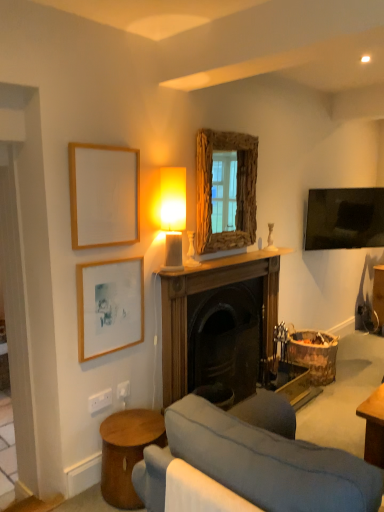
Question: From the image's perspective, is velvet grey couch at lower center located above rustic wood mirror at upper center?

Choices:
 (A) yes
 (B) no

Answer: (B)

Question: Is velvet grey couch at lower center thinner than rustic wood mirror at upper center?

Choices:
 (A) yes
 (B) no

Answer: (B)

Question: Would you say velvet grey couch at lower center contains rustic wood mirror at upper center?

Choices:
 (A) yes
 (B) no

Answer: (B)

Question: From a real-world perspective, is velvet grey couch at lower center under rustic wood mirror at upper center?

Choices:
 (A) yes
 (B) no

Answer: (A)

Question: Does velvet grey couch at lower center have a larger size compared to rustic wood mirror at upper center?

Choices:
 (A) yes
 (B) no

Answer: (A)

Question: In terms of height, does matte wooden picture frame at upper left, which is the 1th picture frame from top to bottom, look taller or shorter compared to rustic wood mirror at upper center?

Choices:
 (A) short
 (B) tall

Answer: (A)

Question: Is matte wooden picture frame at upper left, which is the 1th picture frame from top to bottom, in front of or behind rustic wood mirror at upper center in the image?

Choices:
 (A) front
 (B) behind

Answer: (A)

Question: Choose the correct answer: Is matte wooden picture frame at upper left, which is the 1th picture frame from top to bottom, inside rustic wood mirror at upper center or outside it?

Choices:
 (A) inside
 (B) outside

Answer: (B)

Question: Based on their sizes in the image, would you say matte wooden picture frame at upper left, the second picture frame positioned from the bottom, is bigger or smaller than rustic wood mirror at upper center?

Choices:
 (A) big
 (B) small

Answer: (B)

Question: Choose the correct answer: Is velvet grey couch at lower center inside wooden picture frame at lower left, positioned as the 1th picture frame in bottom-to-top order, or outside it?

Choices:
 (A) inside
 (B) outside

Answer: (B)

Question: Based on their sizes in the image, would you say velvet grey couch at lower center is bigger or smaller than wooden picture frame at lower left, positioned as the 1th picture frame in bottom-to-top order?

Choices:
 (A) small
 (B) big

Answer: (B)

Question: From a real-world perspective, is velvet grey couch at lower center positioned above or below wooden picture frame at lower left, which ranks as the 2th picture frame in top-to-bottom order?

Choices:
 (A) above
 (B) below

Answer: (B)

Question: Is point (160, 486) positioned closer to the camera than point (115, 273)?

Choices:
 (A) farther
 (B) closer

Answer: (B)

Question: Is matte white table lamp at upper center bigger or smaller than velvet grey couch at lower center?

Choices:
 (A) small
 (B) big

Answer: (A)

Question: Does point (180, 172) appear closer or farther from the camera than point (205, 432)?

Choices:
 (A) farther
 (B) closer

Answer: (A)